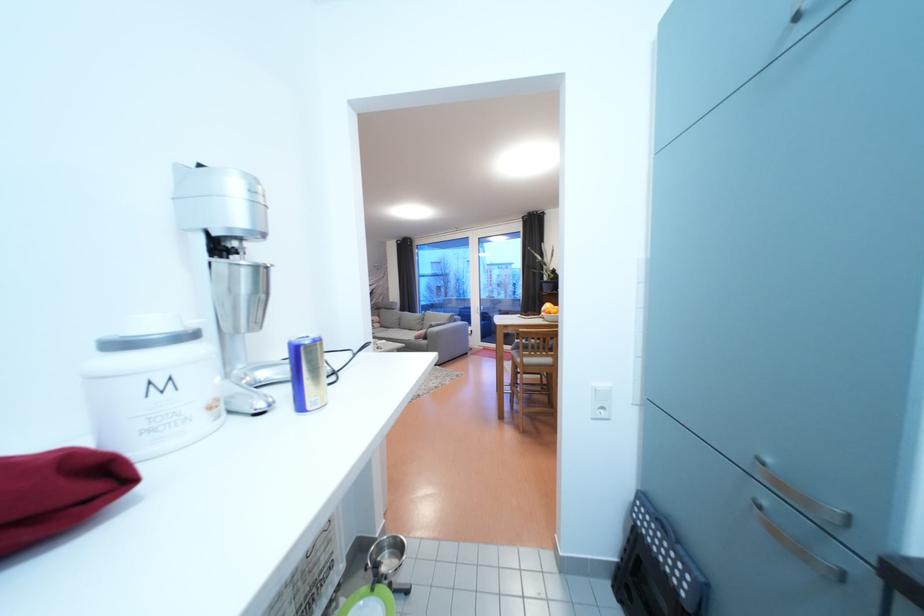
This screenshot has width=924, height=616. What are the coordinates of `white container lid` in the screenshot? It's located at (149, 334).